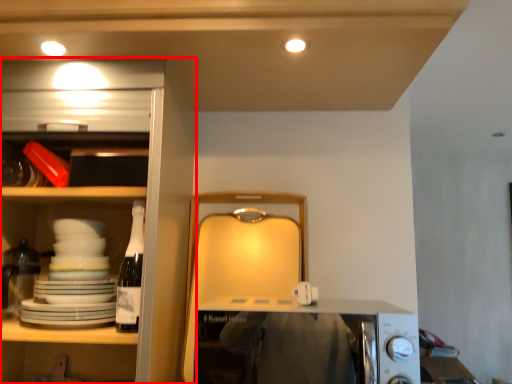
Question: Where is cabinetry (annotated by the red box) located in relation to appliance in the image?

Choices:
 (A) left
 (B) right

Answer: (A)